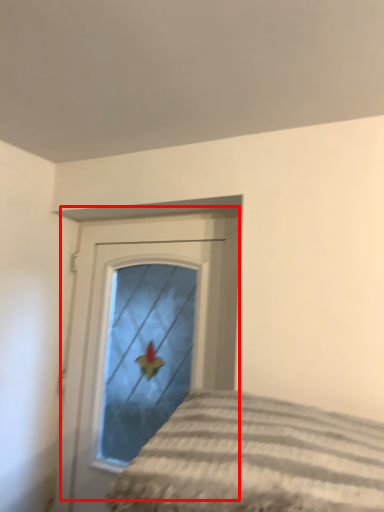
Question: From the image's perspective, where is door (annotated by the red box) located in relation to bed in the image?

Choices:
 (A) below
 (B) above

Answer: (A)